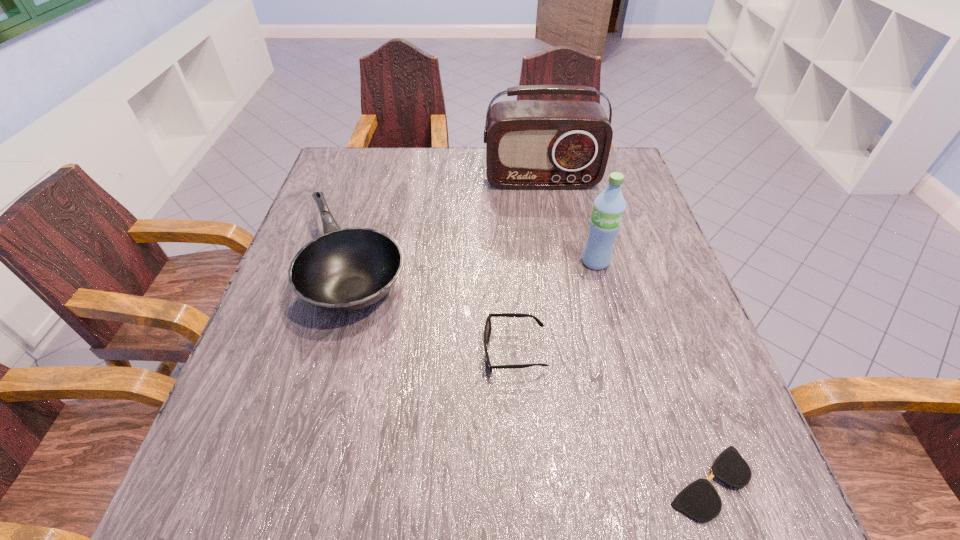
Locate an element on the screen. object that is positioned at the far right corner is located at coordinates point(530,144).

The width and height of the screenshot is (960, 540). Find the location of `object that is at the near right corner`. object that is at the near right corner is located at coordinates (699, 500).

This screenshot has width=960, height=540. In order to click on free region at the far edge of the desktop in this screenshot , I will do `click(429, 168)`.

The width and height of the screenshot is (960, 540). Identify the location of free space at the left edge of the desktop. (343, 208).

In the image, there is a desktop. At what (x,y) coordinates should I click in order to perform the action: click on free space at the right edge. Please return your answer as a coordinate pair (x, y). This screenshot has width=960, height=540. Looking at the image, I should click on (619, 255).

Identify the location of vacant space at the far left corner of the desktop. The image size is (960, 540). (382, 165).

Where is `vacant space at the near left corner of the desktop`? The height and width of the screenshot is (540, 960). vacant space at the near left corner of the desktop is located at coordinates (187, 498).

Where is `free space between the nearest object and the radio receiver`? This screenshot has width=960, height=540. free space between the nearest object and the radio receiver is located at coordinates (625, 331).

The width and height of the screenshot is (960, 540). Identify the location of free space that is in between the water bottle and the radio receiver. (568, 220).

Locate an element on the screen. The image size is (960, 540). unoccupied area between the leftmost object and the farthest object is located at coordinates (449, 224).